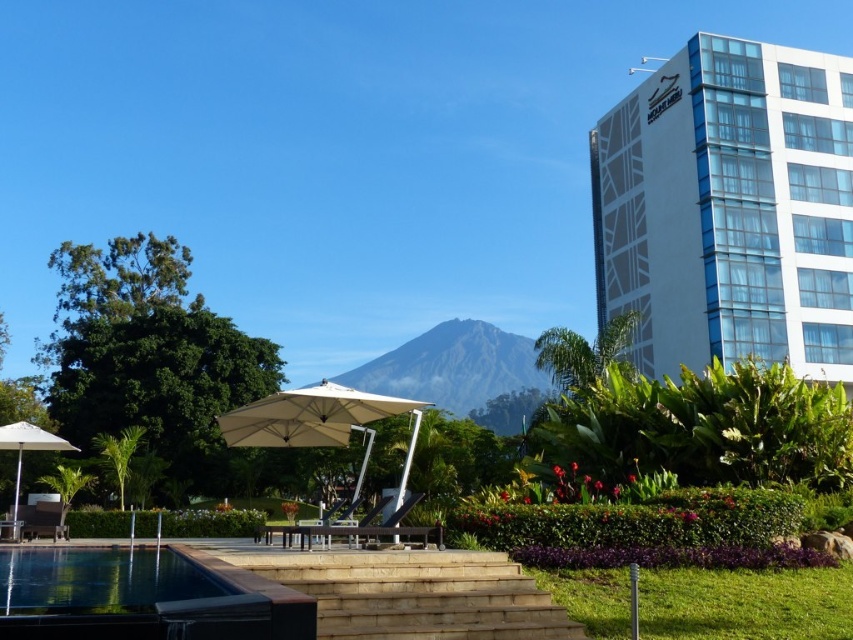
Question: Does white glass building at upper right appear over white matte umbrella at lower left?

Choices:
 (A) no
 (B) yes

Answer: (B)

Question: Does white glass building at upper right have a smaller size compared to beige fabric umbrella at center?

Choices:
 (A) yes
 (B) no

Answer: (B)

Question: Which of the following is the farthest from the observer?

Choices:
 (A) (415, 420)
 (B) (16, 506)

Answer: (A)

Question: Does beige fabric umbrella at center lie in front of white matte umbrella at lower left?

Choices:
 (A) no
 (B) yes

Answer: (B)

Question: Among these points, which one is farthest from the camera?

Choices:
 (A) (13, 428)
 (B) (808, 138)
 (C) (234, 436)

Answer: (B)

Question: Which object appears closest to the camera in this image?

Choices:
 (A) white glass building at upper right
 (B) white matte umbrella at lower left

Answer: (B)